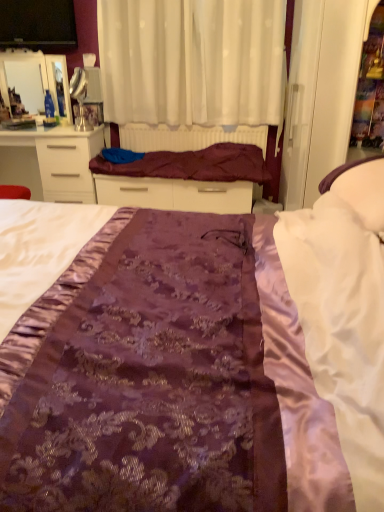
Where is `free space above purple satin bed frame at center (from a real-world perspective)`? free space above purple satin bed frame at center (from a real-world perspective) is located at coordinates (185, 122).